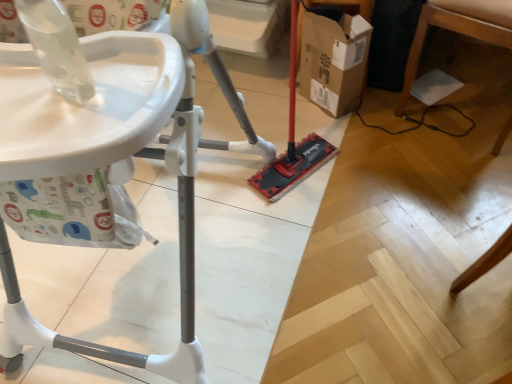
I want to click on vacant area located to the right-hand side of cardboard box at center, so click(x=391, y=112).